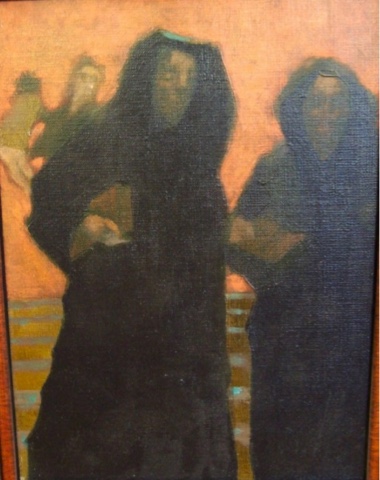
Identify the location of space beside painting. (7, 455), (374, 458).